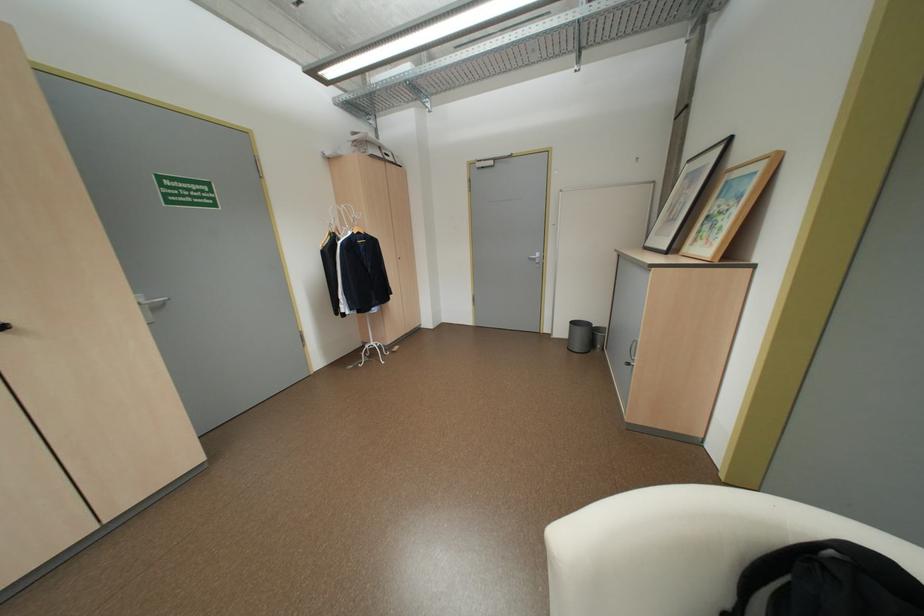
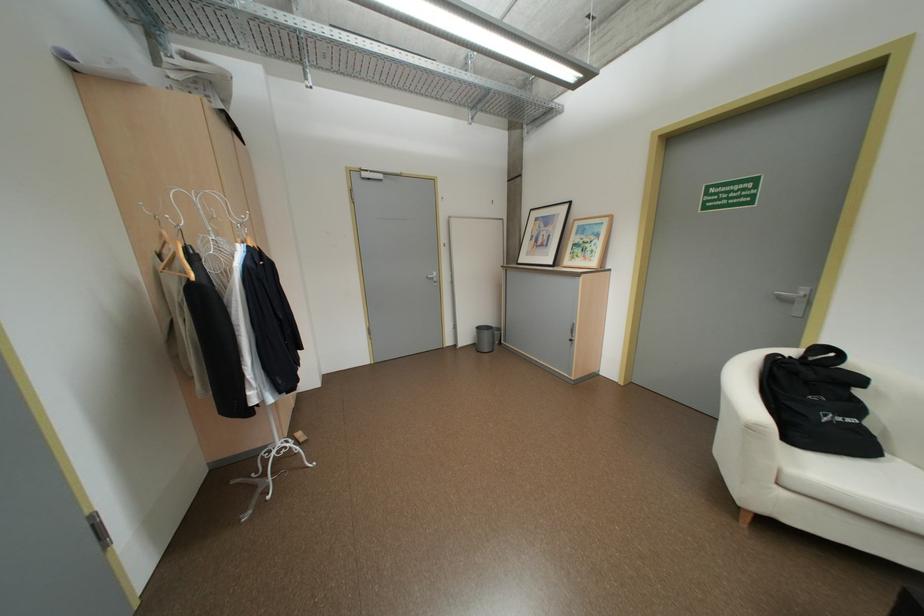
In the second image, find the point that corresponds to [675,246] in the first image.

(561, 262)